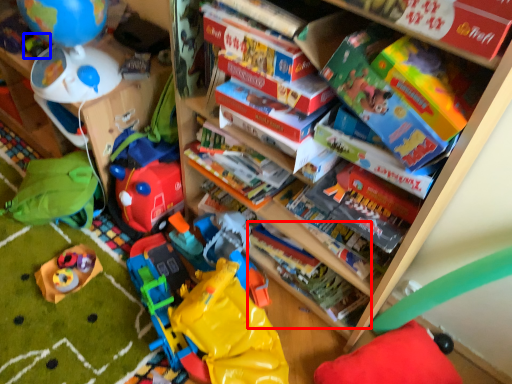
Question: Among these objects, which one is nearest to the camera, book (highlighted by a red box) or toy (highlighted by a blue box)?

Choices:
 (A) book
 (B) toy

Answer: (A)